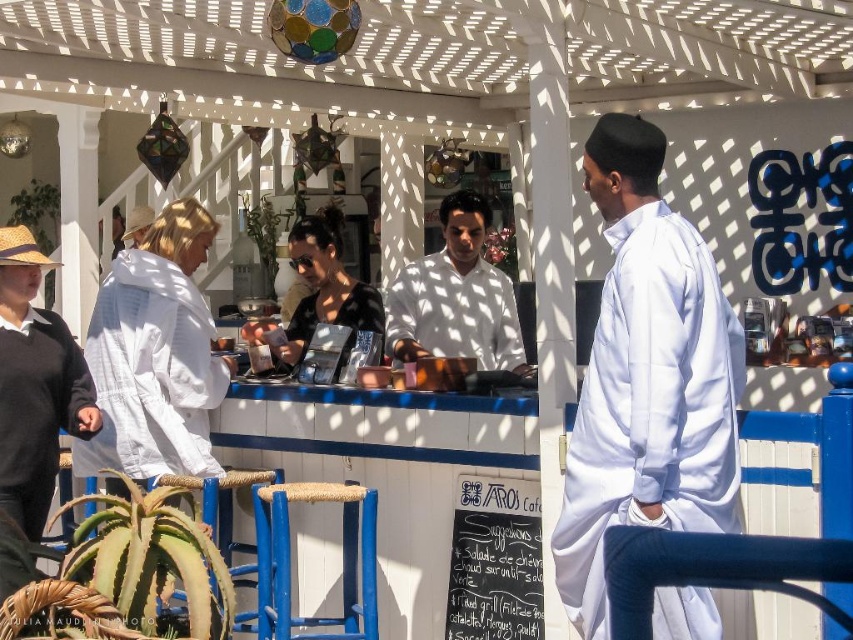
Is point (399, 353) closer to camera compared to point (373, 589)?

No.

Does point (514, 314) come in front of point (352, 600)?

No.

At what (x,y) coordinates should I click in order to perform the action: click on white glossy shirt at center. Please return your answer as a coordinate pair (x, y). This screenshot has width=853, height=640. Looking at the image, I should click on (456, 298).

How distant is black chalkboard at lower center from blue wood stool at center?

black chalkboard at lower center is 36.82 inches away from blue wood stool at center.

Can you confirm if black chalkboard at lower center is positioned above blue wood stool at center?

Indeed, black chalkboard at lower center is positioned over blue wood stool at center.

The image size is (853, 640). What do you see at coordinates (495, 561) in the screenshot? I see `black chalkboard at lower center` at bounding box center [495, 561].

Find the location of a particular element. The image size is (853, 640). black chalkboard at lower center is located at coordinates (495, 561).

Who is positioned more to the left, dark brown sweater at left or rope-wrapped stool at lower left?

dark brown sweater at left

Which of these two, dark brown sweater at left or rope-wrapped stool at lower left, stands taller?

Standing taller between the two is dark brown sweater at left.

Is point (16, 484) behind point (250, 550)?

No, (16, 484) is closer to viewer.

You are a GUI agent. You are given a task and a screenshot of the screen. Output one action in this format:
    pyautogui.click(x=<x>, y=<y>)
    Task: Click on the dark brown sweater at left
    Image resolution: width=853 pixels, height=640 pixels.
    Given the screenshot: What is the action you would take?
    pyautogui.click(x=35, y=385)